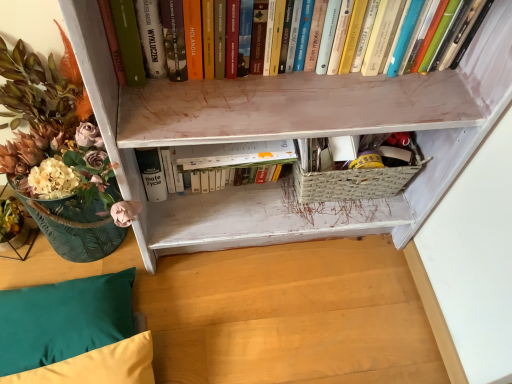
Question: Is velvet yellow pillow at lower left, placed as the first pillow when sorted from bottom to top, not inside translucent glass vase at left?

Choices:
 (A) no
 (B) yes

Answer: (B)

Question: Is velvet yellow pillow at lower left, placed as the first pillow when sorted from bottom to top, thinner than translucent glass vase at left?

Choices:
 (A) no
 (B) yes

Answer: (B)

Question: Is the surface of velvet yellow pillow at lower left, placed as the first pillow when sorted from bottom to top, in direct contact with translucent glass vase at left?

Choices:
 (A) no
 (B) yes

Answer: (A)

Question: Is velvet yellow pillow at lower left, placed as the 2th pillow when sorted from top to bottom, oriented towards translucent glass vase at left?

Choices:
 (A) no
 (B) yes

Answer: (A)

Question: From the image's perspective, is velvet yellow pillow at lower left, placed as the first pillow when sorted from bottom to top, located above translucent glass vase at left?

Choices:
 (A) no
 (B) yes

Answer: (A)

Question: Considering the relative sizes of velvet yellow pillow at lower left, placed as the 2th pillow when sorted from top to bottom, and translucent glass vase at left in the image provided, is velvet yellow pillow at lower left, placed as the 2th pillow when sorted from top to bottom, shorter than translucent glass vase at left?

Choices:
 (A) yes
 (B) no

Answer: (A)

Question: Does white matte book at center, the first book ordered from the bottom, have a smaller size compared to teal fabric pillow at lower left, placed as the 2th pillow when sorted from bottom to top?

Choices:
 (A) yes
 (B) no

Answer: (A)

Question: Is the position of white matte book at center, which ranks as the 2th book in front-to-back order, less distant than that of teal fabric pillow at lower left, the first pillow viewed from the top?

Choices:
 (A) no
 (B) yes

Answer: (A)

Question: Is the depth of white matte book at center, which is the 2th book from top to bottom, greater than that of teal fabric pillow at lower left, the first pillow viewed from the top?

Choices:
 (A) no
 (B) yes

Answer: (B)

Question: Is there a large distance between white matte book at center, the first book ordered from the bottom, and teal fabric pillow at lower left, placed as the 2th pillow when sorted from bottom to top?

Choices:
 (A) no
 (B) yes

Answer: (A)

Question: From a real-world perspective, is white matte book at center, which ranks as the 2th book in front-to-back order, under teal fabric pillow at lower left, the first pillow viewed from the top?

Choices:
 (A) no
 (B) yes

Answer: (A)

Question: Is white matte book at center, which is the 2th book from top to bottom, facing away from teal fabric pillow at lower left, the first pillow viewed from the top?

Choices:
 (A) no
 (B) yes

Answer: (A)

Question: Is hardcover books at upper center, placed as the 1th book when sorted from front to back, positioned before velvet yellow pillow at lower left, placed as the 2th pillow when sorted from top to bottom?

Choices:
 (A) yes
 (B) no

Answer: (A)